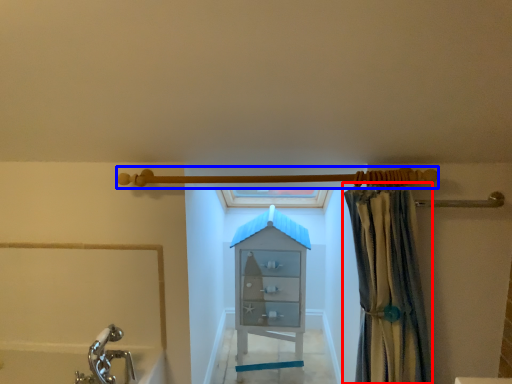
Question: Which object appears closest to the camera in this image, curtain (highlighted by a red box) or shower (highlighted by a blue box)?

Choices:
 (A) curtain
 (B) shower

Answer: (A)